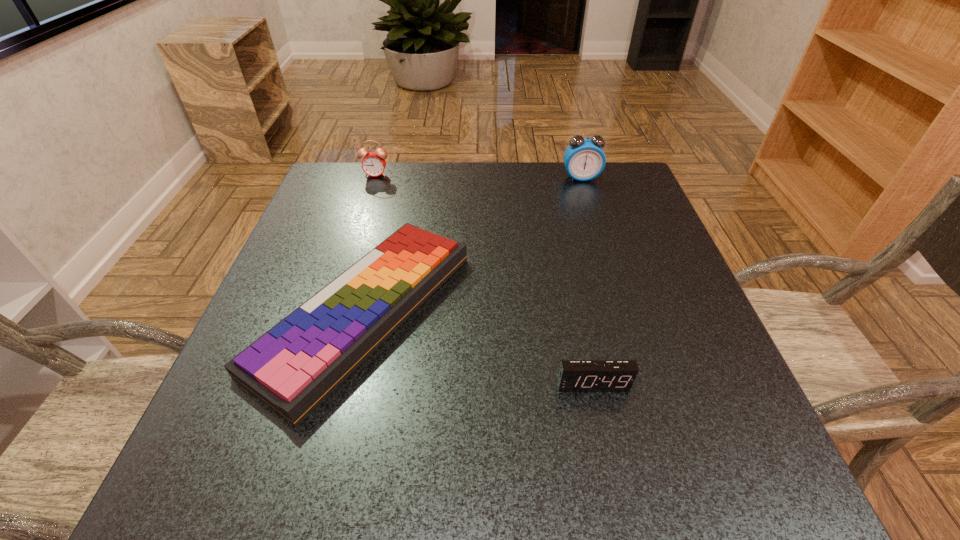
This screenshot has height=540, width=960. Find the location of `free space at the near right corner of the desktop`. free space at the near right corner of the desktop is located at coordinates click(760, 481).

Find the location of `empty location between the computer keyboard and the shortest alarm clock`. empty location between the computer keyboard and the shortest alarm clock is located at coordinates (478, 348).

At what (x,y) coordinates should I click in order to perform the action: click on vacant space that's between the computer keyboard and the nearest alarm clock. Please return your answer as a coordinate pair (x, y). Looking at the image, I should click on (478, 348).

Where is `free space between the computer keyboard and the nearest alarm clock`? This screenshot has height=540, width=960. free space between the computer keyboard and the nearest alarm clock is located at coordinates (478, 348).

You are a GUI agent. You are given a task and a screenshot of the screen. Output one action in this format:
    pyautogui.click(x=<x>, y=<y>)
    Task: Click on the vacant space in between the shortest alarm clock and the second shortest alarm clock
    
    Given the screenshot: What is the action you would take?
    pyautogui.click(x=484, y=279)

What are the coordinates of `vacant space that is in between the computer keyboard and the tallest object` in the screenshot? It's located at (472, 245).

Identify the location of free spot between the shortest alarm clock and the computer keyboard. (478, 348).

You are a GUI agent. You are given a task and a screenshot of the screen. Output one action in this format:
    pyautogui.click(x=<x>, y=<y>)
    Task: Click on the vacant area that lies between the nearest alarm clock and the tallest alarm clock
    The image size is (960, 540).
    Given the screenshot: What is the action you would take?
    pyautogui.click(x=587, y=281)

I want to click on free area in between the tallest alarm clock and the leftmost alarm clock, so click(x=478, y=176).

Find the location of a particular element. The width and height of the screenshot is (960, 540). free space that is in between the computer keyboard and the second tallest object is located at coordinates (370, 243).